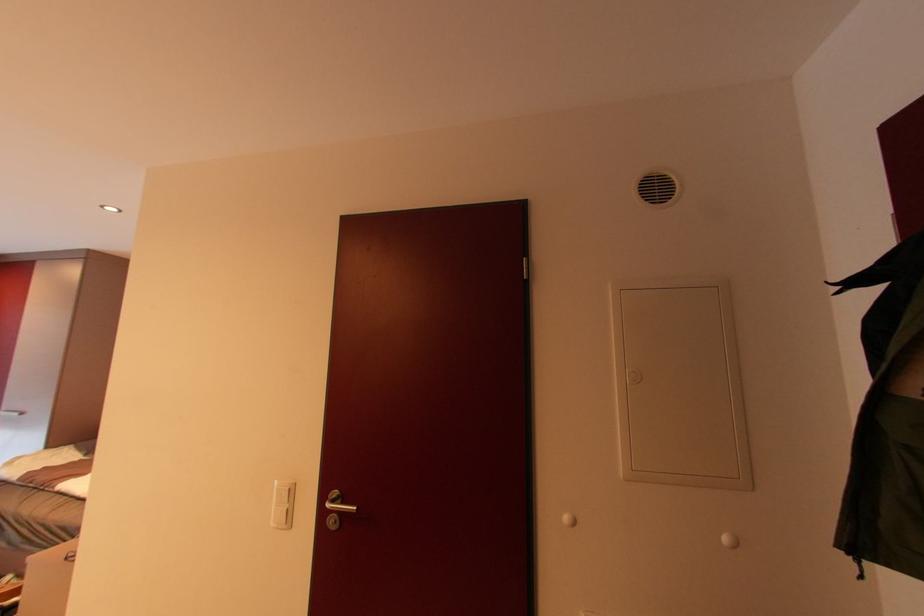
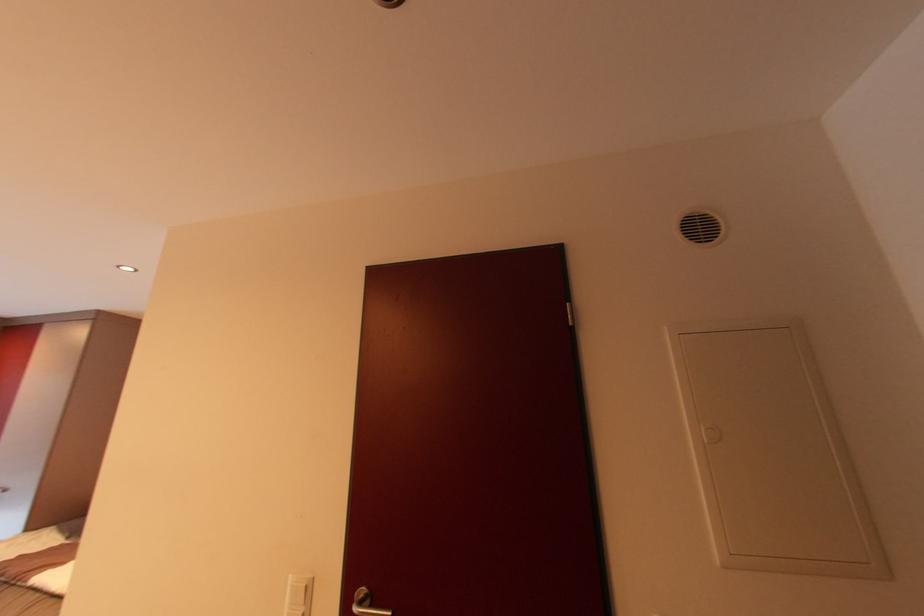
Based on the photo, which direction would the cameraman need to move to produce the second image?

The movement direction of the cameraman is left, forward.